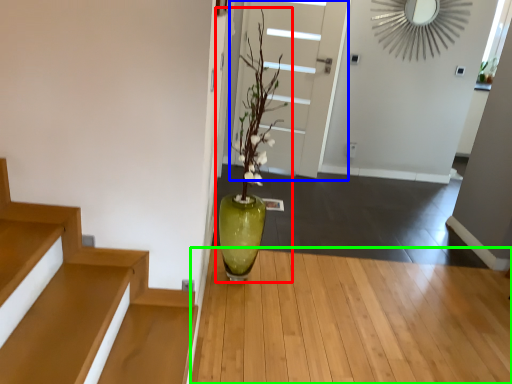
Question: Which is farther away from houseplant (highlighted by a red box)? door (highlighted by a blue box) or hardwood (highlighted by a green box)?

Choices:
 (A) door
 (B) hardwood

Answer: (A)